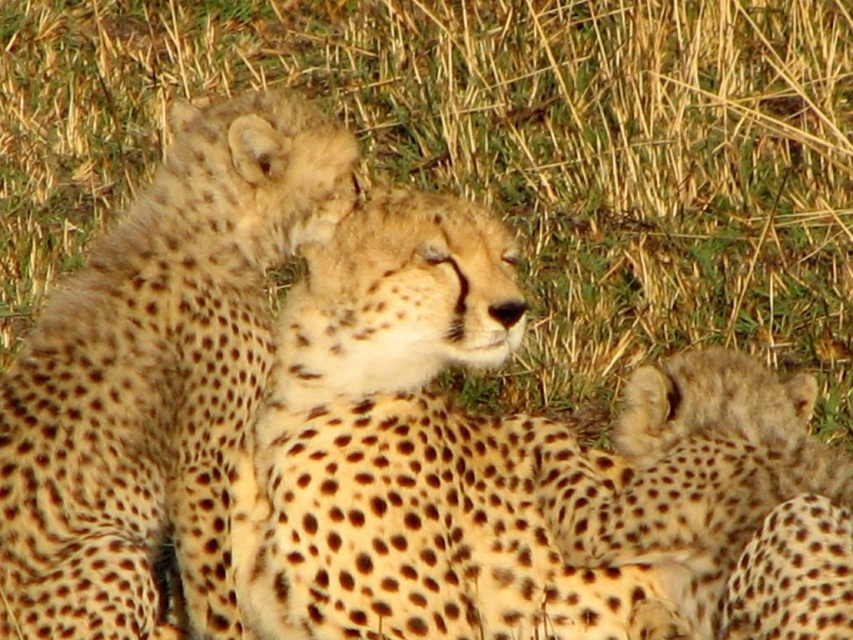
Question: Estimate the real-world distances between objects in this image. Which object is closer to the spotted fur cheetah cub at lower right?

Choices:
 (A) yellowish grass at center
 (B) spotted fur cheetah at center
 (C) spotted fur cheetah cub at upper center

Answer: (B)

Question: Considering the relative positions of yellowish grass at center and spotted fur cheetah at center in the image provided, where is yellowish grass at center located with respect to spotted fur cheetah at center?

Choices:
 (A) right
 (B) left

Answer: (B)

Question: Does spotted fur cheetah at center appear on the right side of spotted fur cheetah cub at upper center?

Choices:
 (A) no
 (B) yes

Answer: (B)

Question: Does spotted fur cheetah cub at upper center have a greater width compared to spotted fur cheetah cub at lower right?

Choices:
 (A) no
 (B) yes

Answer: (B)

Question: Which is farther from the spotted fur cheetah cub at upper center?

Choices:
 (A) spotted fur cheetah cub at lower right
 (B) spotted fur cheetah at center

Answer: (A)

Question: Which of the following is the closest to the observer?

Choices:
 (A) spotted fur cheetah at center
 (B) spotted fur cheetah cub at upper center

Answer: (A)